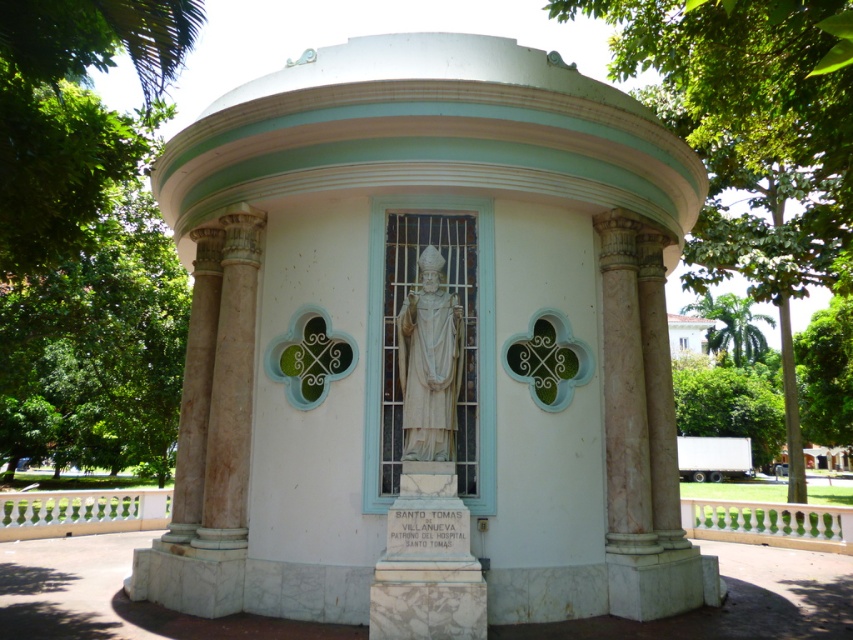
Question: Does white marble chapel at center have a larger size compared to green leafy tree at center?

Choices:
 (A) no
 (B) yes

Answer: (A)

Question: Among these objects, which one is nearest to the camera?

Choices:
 (A) green leafy tree at upper left
 (B) green leafy tree at center

Answer: (B)

Question: Based on their relative distances, which object is farther from the green leafy tree at center?

Choices:
 (A) white marble chapel at center
 (B) green leafy palm at upper right
 (C) white marble statue at center

Answer: (B)

Question: Does green leafy tree at upper left appear on the right side of white marble statue at center?

Choices:
 (A) yes
 (B) no

Answer: (B)

Question: Which object appears farthest from the camera in this image?

Choices:
 (A) green leafy tree at center
 (B) white marble chapel at center
 (C) green leafy tree at upper left
 (D) green leafy palm at upper right

Answer: (D)

Question: Can you confirm if green leafy tree at upper left is positioned to the right of white marble statue at center?

Choices:
 (A) yes
 (B) no

Answer: (B)